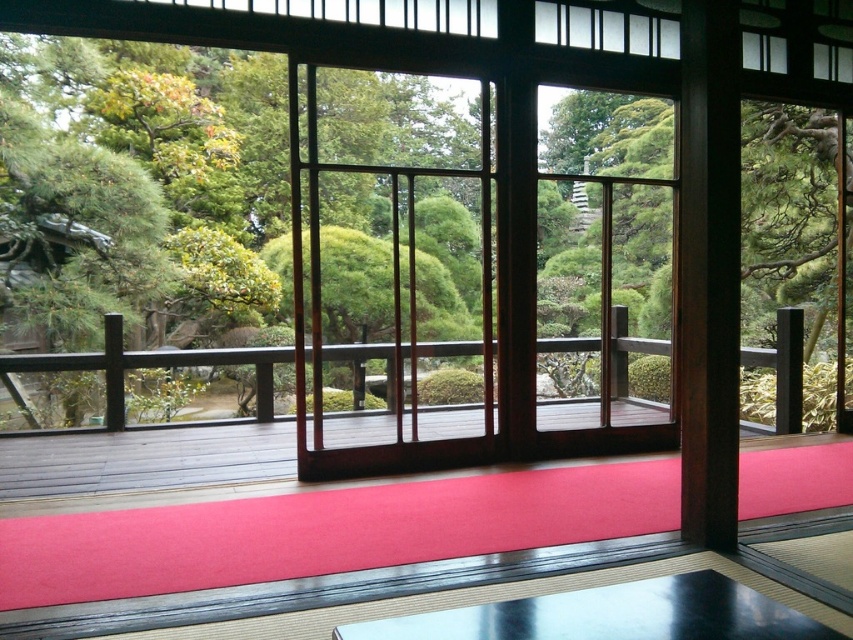
Which is more to the right, green leafy tree at center or smooth red mat at center?

From the viewer's perspective, green leafy tree at center appears more on the right side.

Does green leafy tree at center have a greater height compared to smooth red mat at center?

Indeed, green leafy tree at center has a greater height compared to smooth red mat at center.

Is point (659, 312) positioned before point (804, 493)?

No.

Locate an element on the screen. The image size is (853, 640). green leafy tree at center is located at coordinates (254, 236).